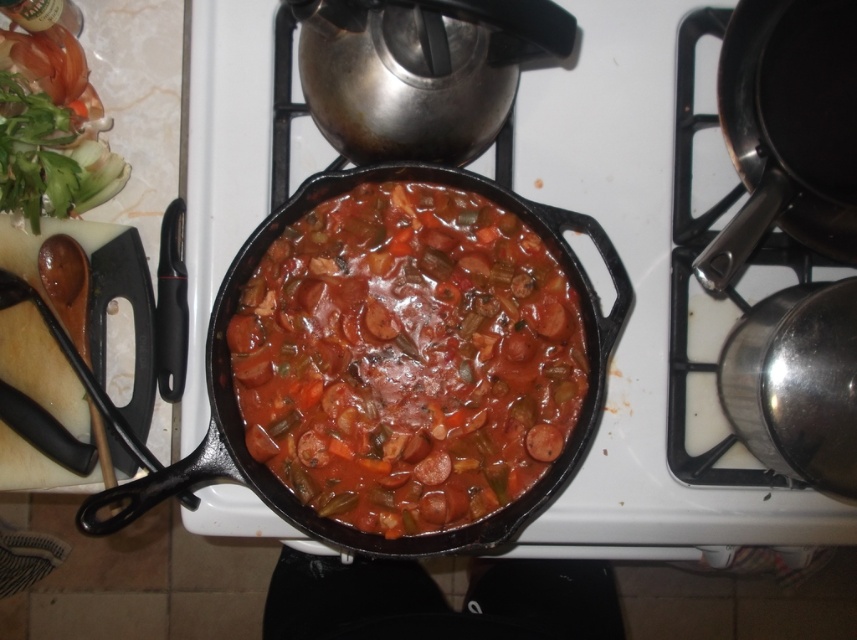
Based on the photo, can you confirm if cast iron skillet at center is positioned below black cast iron frying pan at upper right?

Indeed, cast iron skillet at center is positioned under black cast iron frying pan at upper right.

Is the position of cast iron skillet at center less distant than that of black cast iron frying pan at upper right?

No, it is not.

Is point (716, 314) positioned after point (760, 54)?

That is True.

Identify the location of cast iron skillet at center. The height and width of the screenshot is (640, 857). (636, 300).

Who is taller, cast iron skillet at center or green leafy vegetable at upper left?

Standing taller between the two is cast iron skillet at center.

Who is lower down, cast iron skillet at center or green leafy vegetable at upper left?

cast iron skillet at center is below.

Image resolution: width=857 pixels, height=640 pixels. In order to click on cast iron skillet at center in this screenshot , I will do `click(636, 300)`.

This screenshot has height=640, width=857. I want to click on cast iron skillet at center, so click(636, 300).

This screenshot has width=857, height=640. What do you see at coordinates (787, 129) in the screenshot? I see `black cast iron frying pan at upper right` at bounding box center [787, 129].

Does black cast iron frying pan at upper right come behind green leafy vegetable at upper left?

No, it is in front of green leafy vegetable at upper left.

Does point (794, 65) lie behind point (81, 92)?

No.

Where is `black cast iron frying pan at upper right`? The image size is (857, 640). black cast iron frying pan at upper right is located at coordinates (787, 129).